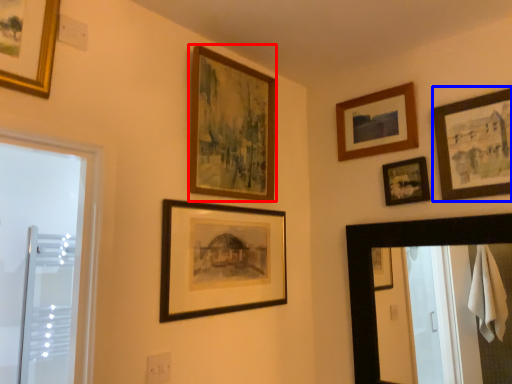
Question: Among these objects, which one is nearest to the camera, picture frame (highlighted by a red box) or picture frame (highlighted by a blue box)?

Choices:
 (A) picture frame
 (B) picture frame

Answer: (B)